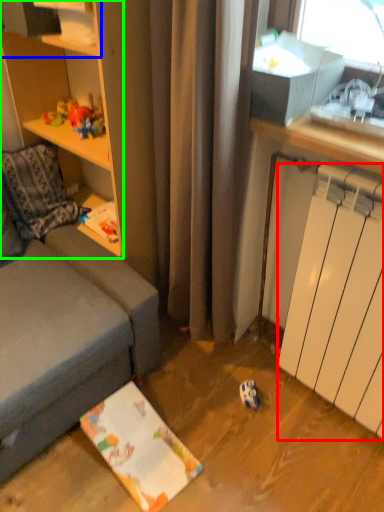
Question: Which is nearer to the radiator (highlighted by a red box)? shelf (highlighted by a blue box) or cabinetry (highlighted by a green box).

Choices:
 (A) shelf
 (B) cabinetry

Answer: (B)